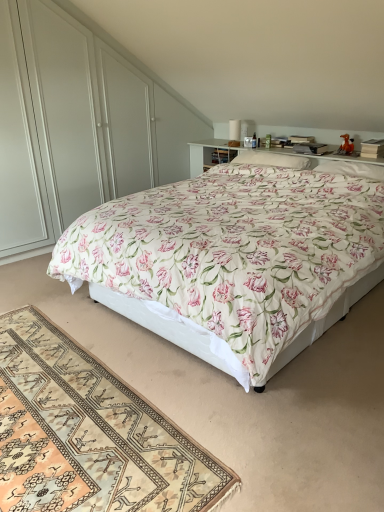
Question: Do you think white glossy dresser at upper center is within white soft pillow at center, the 1th pillow viewed from the left, or outside of it?

Choices:
 (A) outside
 (B) inside

Answer: (A)

Question: In terms of width, does white glossy dresser at upper center look wider or thinner when compared to white soft pillow at center, the 1th pillow viewed from the left?

Choices:
 (A) thin
 (B) wide

Answer: (A)

Question: Which is nearer to the white glossy dresser at upper center?

Choices:
 (A) beige woven rug at lower left
 (B) white soft pillow at upper right, the 1th pillow from the right
 (C) white soft pillow at center, the 2th pillow viewed from the right
 (D) floral cotton bed at center

Answer: (C)

Question: Estimate the real-world distances between objects in this image. Which object is farther from the beige woven rug at lower left?

Choices:
 (A) white soft pillow at upper right, the 2th pillow when ordered from left to right
 (B) floral cotton bed at center
 (C) white glossy dresser at upper center
 (D) white soft pillow at center, the 2th pillow viewed from the right

Answer: (A)